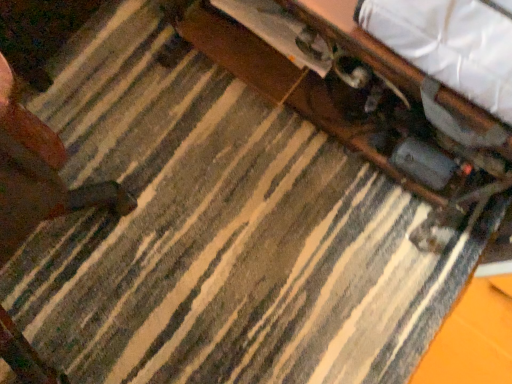
Question: Is wooden table at center placed right next to wooden drawer at upper center?

Choices:
 (A) no
 (B) yes

Answer: (A)

Question: Is wooden table at center not close to wooden drawer at upper center?

Choices:
 (A) yes
 (B) no

Answer: (B)

Question: Considering the relative sizes of wooden table at center and wooden drawer at upper center in the image provided, is wooden table at center smaller than wooden drawer at upper center?

Choices:
 (A) yes
 (B) no

Answer: (B)

Question: Considering the relative positions of wooden table at center and wooden drawer at upper center in the image provided, is wooden table at center behind wooden drawer at upper center?

Choices:
 (A) no
 (B) yes

Answer: (A)

Question: From a real-world perspective, does wooden table at center stand above wooden drawer at upper center?

Choices:
 (A) no
 (B) yes

Answer: (B)

Question: From a real-world perspective, is wooden drawer at upper center above or below wooden table at center?

Choices:
 (A) below
 (B) above

Answer: (A)

Question: Considering the relative positions of wooden drawer at upper center and wooden table at center in the image provided, is wooden drawer at upper center to the left or to the right of wooden table at center?

Choices:
 (A) right
 (B) left

Answer: (B)

Question: From the image's perspective, is wooden drawer at upper center above or below wooden table at center?

Choices:
 (A) above
 (B) below

Answer: (A)

Question: Which is correct: wooden drawer at upper center is inside wooden table at center, or outside of it?

Choices:
 (A) outside
 (B) inside

Answer: (B)

Question: Considering their positions, is wooden table at center located in front of or behind white fabric at upper right?

Choices:
 (A) behind
 (B) front

Answer: (A)

Question: Considering the positions of wooden table at center and white fabric at upper right in the image, is wooden table at center wider or thinner than white fabric at upper right?

Choices:
 (A) thin
 (B) wide

Answer: (B)

Question: Considering the positions of wooden table at center and white fabric at upper right in the image, is wooden table at center bigger or smaller than white fabric at upper right?

Choices:
 (A) small
 (B) big

Answer: (B)

Question: Considering the positions of point (487, 132) and point (465, 16), is point (487, 132) closer or farther from the camera than point (465, 16)?

Choices:
 (A) closer
 (B) farther

Answer: (B)

Question: Looking at their shapes, would you say wooden drawer at upper center is wider or thinner than white fabric at upper right?

Choices:
 (A) thin
 (B) wide

Answer: (B)

Question: From the image's perspective, is wooden drawer at upper center located above or below white fabric at upper right?

Choices:
 (A) above
 (B) below

Answer: (A)